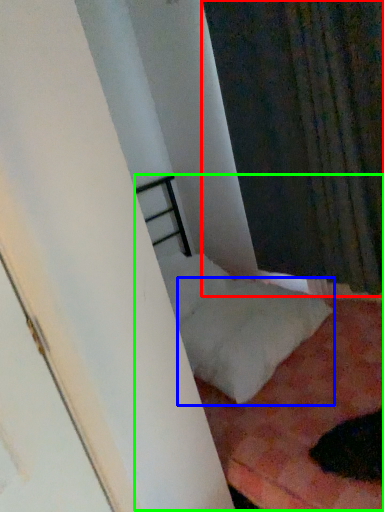
Question: Estimate the real-world distances between objects in this image. Which object is closer to curtain (highlighted by a red box), pillow (highlighted by a blue box) or bed (highlighted by a green box)?

Choices:
 (A) pillow
 (B) bed

Answer: (A)